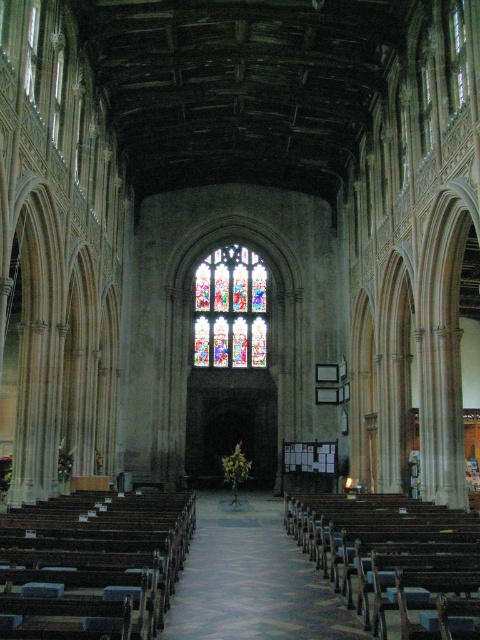
Question: Which of these objects is positioned farthest from the stained glass window at center?

Choices:
 (A) wooden polished pews at center
 (B) wooden polished bench at lower left
 (C) wooden polished bench at center

Answer: (B)

Question: Which object is closer to the camera taking this photo?

Choices:
 (A) wooden polished pews at center
 (B) wooden polished bench at lower left
 (C) wooden polished bench at center

Answer: (B)

Question: Among these objects, which one is farthest from the camera?

Choices:
 (A) wooden polished bench at center
 (B) wooden polished bench at lower left
 (C) wooden polished pews at center

Answer: (C)

Question: Is wooden polished bench at center positioned before wooden polished pews at center?

Choices:
 (A) no
 (B) yes

Answer: (B)

Question: Does wooden polished pews at center have a larger size compared to stained glass window at center?

Choices:
 (A) yes
 (B) no

Answer: (A)

Question: Can you confirm if wooden polished bench at center is smaller than wooden polished pews at center?

Choices:
 (A) no
 (B) yes

Answer: (A)